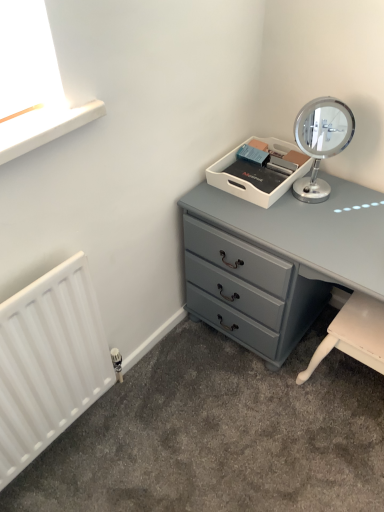
Question: Does matte gray chest of drawers at center lie behind white matte radiator at lower left?

Choices:
 (A) no
 (B) yes

Answer: (B)

Question: Does matte gray chest of drawers at center appear on the left side of white matte radiator at lower left?

Choices:
 (A) yes
 (B) no

Answer: (B)

Question: Is matte gray chest of drawers at center with white matte radiator at lower left?

Choices:
 (A) no
 (B) yes

Answer: (A)

Question: Is the position of matte gray chest of drawers at center less distant than that of white matte radiator at lower left?

Choices:
 (A) yes
 (B) no

Answer: (B)

Question: Does matte gray chest of drawers at center appear on the right side of white matte radiator at lower left?

Choices:
 (A) no
 (B) yes

Answer: (B)

Question: Considering the relative sizes of matte gray chest of drawers at center and white matte radiator at lower left in the image provided, is matte gray chest of drawers at center taller than white matte radiator at lower left?

Choices:
 (A) no
 (B) yes

Answer: (A)

Question: Does matte gray chest of drawers at center have a larger size compared to polished chrome mirror at upper right?

Choices:
 (A) yes
 (B) no

Answer: (A)

Question: Is matte gray chest of drawers at center to the right of polished chrome mirror at upper right from the viewer's perspective?

Choices:
 (A) no
 (B) yes

Answer: (B)

Question: Does matte gray chest of drawers at center turn towards polished chrome mirror at upper right?

Choices:
 (A) yes
 (B) no

Answer: (B)

Question: From the image's perspective, is matte gray chest of drawers at center below polished chrome mirror at upper right?

Choices:
 (A) no
 (B) yes

Answer: (B)

Question: Is matte gray chest of drawers at center not close to polished chrome mirror at upper right?

Choices:
 (A) yes
 (B) no

Answer: (B)

Question: Does matte gray chest of drawers at center lie in front of polished chrome mirror at upper right?

Choices:
 (A) yes
 (B) no

Answer: (A)

Question: Is white plastic tray at upper center at the right side of polished chrome mirror at upper right?

Choices:
 (A) yes
 (B) no

Answer: (B)